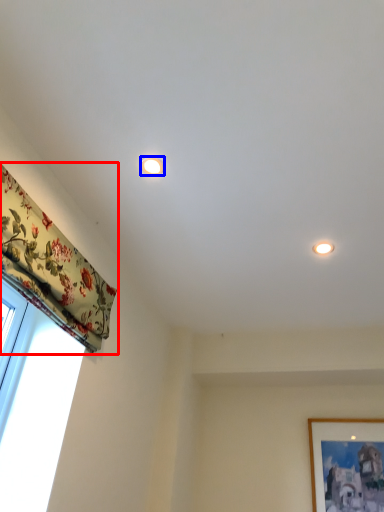
Question: Which point is closer to the camera, curtain (highlighted by a red box) or lighting (highlighted by a blue box)?

Choices:
 (A) curtain
 (B) lighting

Answer: (A)